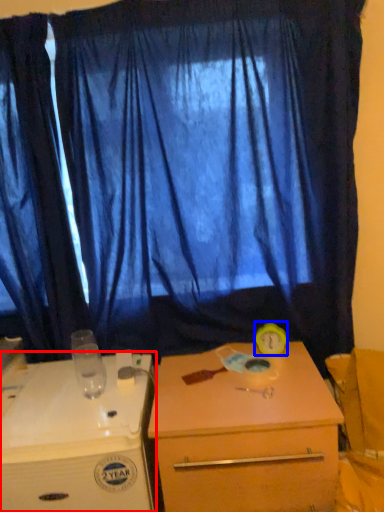
Question: Which object is closer to the camera taking this photo, desk (highlighted by a red box) or alarm clock (highlighted by a blue box)?

Choices:
 (A) desk
 (B) alarm clock

Answer: (A)